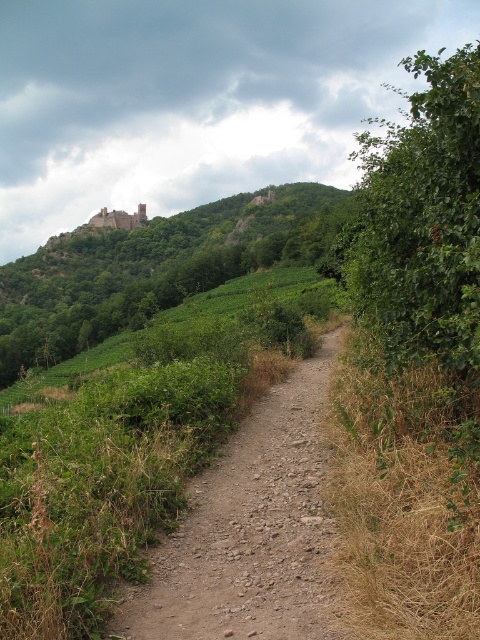
This screenshot has width=480, height=640. What do you see at coordinates (153, 268) in the screenshot?
I see `green leafy hillside at upper left` at bounding box center [153, 268].

Between green leafy hillside at upper left and red brick castle at upper center, which one appears on the left side from the viewer's perspective?

red brick castle at upper center

The image size is (480, 640). In order to click on green leafy hillside at upper left in this screenshot , I will do `click(153, 268)`.

Who is positioned more to the right, dusty gravel path at center or red brick castle at upper center?

Positioned to the right is dusty gravel path at center.

At what (x,y) coordinates should I click in order to perform the action: click on dusty gravel path at center. Please return your answer as a coordinate pair (x, y). This screenshot has width=480, height=640. Looking at the image, I should click on (250, 531).

Describe the element at coordinates (250, 531) in the screenshot. I see `dusty gravel path at center` at that location.

I want to click on dusty gravel path at center, so click(250, 531).

Which is below, dusty gravel path at center or green leafy hillside at upper left?

dusty gravel path at center

Is dusty gravel path at center taller than green leafy hillside at upper left?

No.

Is point (260, 611) positioned in front of point (94, 304)?

Yes, it is in front of point (94, 304).

Locate an element on the screen. This screenshot has height=640, width=480. dusty gravel path at center is located at coordinates (250, 531).